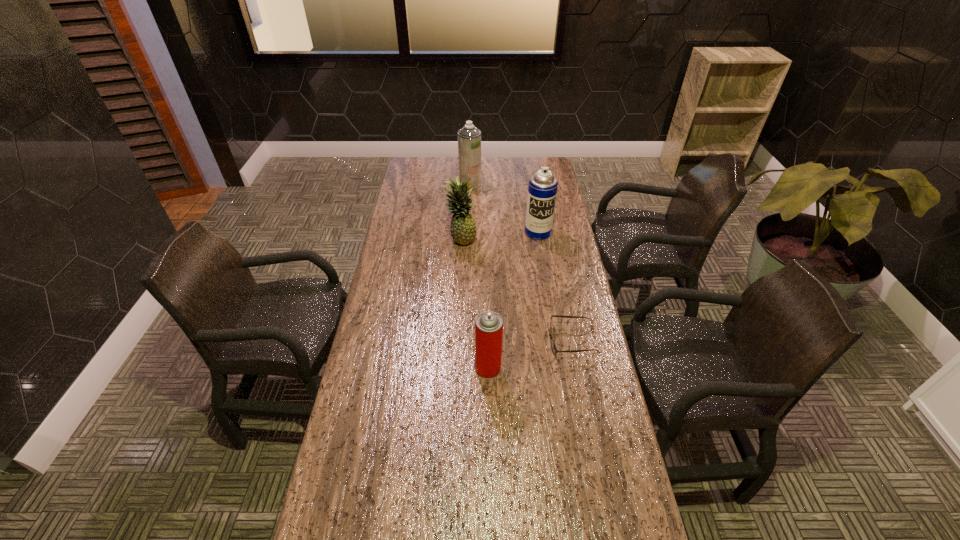
Identify the location of free space that is in between the second nearest aerosol can and the pineapple. (499, 235).

Where is `empty space that is in between the fourth tallest object and the second farthest aerosol can`? This screenshot has width=960, height=540. empty space that is in between the fourth tallest object and the second farthest aerosol can is located at coordinates point(514,300).

Find the location of a particular element. vacant space that's between the second nearest aerosol can and the pineapple is located at coordinates (499, 235).

What are the coordinates of `free point between the rightmost aerosol can and the shortest aerosol can` in the screenshot? It's located at (514, 300).

Locate an element on the screen. This screenshot has width=960, height=540. free area in between the nearest aerosol can and the rightmost aerosol can is located at coordinates (514, 300).

Where is `empty location between the pineapple and the sunglasses`? empty location between the pineapple and the sunglasses is located at coordinates (517, 290).

Image resolution: width=960 pixels, height=540 pixels. Identify the location of vacant area that lies between the pineapple and the fourth tallest object. (474, 303).

This screenshot has height=540, width=960. I want to click on free space between the sunglasses and the pineapple, so click(x=517, y=290).

Identify which object is located as the second nearest to the shortest object. Please provide its 2D coordinates. Your answer should be formatted as a tuple, i.e. [(x, y)], where the tuple contains the x and y coordinates of a point satisfying the conditions above.

[(542, 190)]

Identify which object is the third closest to the second farthest aerosol can. Please provide its 2D coordinates. Your answer should be formatted as a tuple, i.e. [(x, y)], where the tuple contains the x and y coordinates of a point satisfying the conditions above.

[(553, 346)]